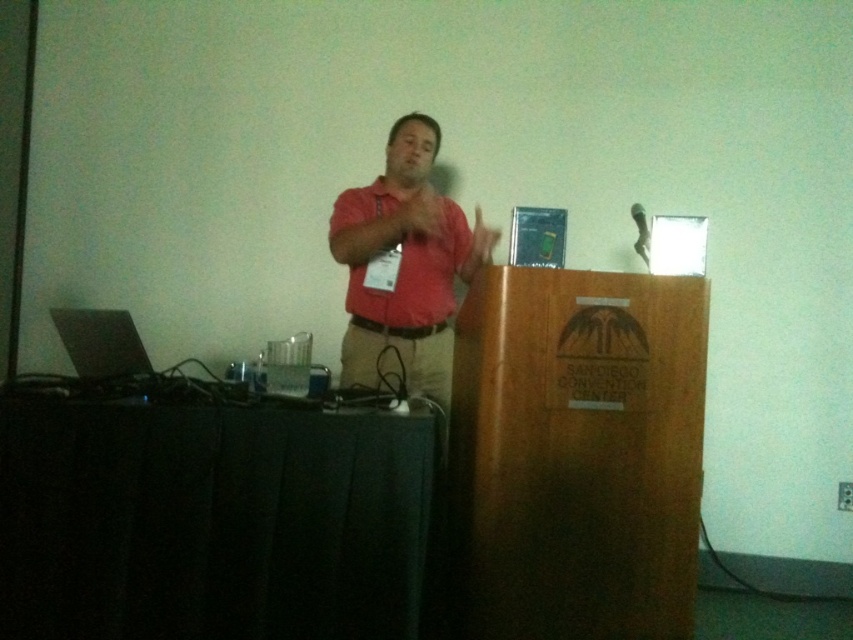
Between matte pink shirt at center and matte red shirt at center, which one appears on the right side from the viewer's perspective?

Positioned to the right is matte pink shirt at center.

Can you confirm if matte pink shirt at center is smaller than matte red shirt at center?

Incorrect, matte pink shirt at center is not smaller in size than matte red shirt at center.

At what (x,y) coordinates should I click in order to perform the action: click on matte pink shirt at center. Please return your answer as a coordinate pair (x, y). Looking at the image, I should click on (401, 262).

Where is `matte pink shirt at center`? The width and height of the screenshot is (853, 640). matte pink shirt at center is located at coordinates (401, 262).

Looking at this image, can you confirm if matte red shirt at center is thinner than matte pink shirt at upper center?

No, matte red shirt at center is not thinner than matte pink shirt at upper center.

Does matte red shirt at center have a greater height compared to matte pink shirt at upper center?

Indeed, matte red shirt at center has a greater height compared to matte pink shirt at upper center.

The width and height of the screenshot is (853, 640). Find the location of `matte red shirt at center`. matte red shirt at center is located at coordinates (416, 276).

Find the location of `matte pink shirt at center`. matte pink shirt at center is located at coordinates (401, 262).

Is point (407, 269) closer to camera compared to point (415, 218)?

No, it is not.

In order to click on matte pink shirt at center in this screenshot , I will do `click(401, 262)`.